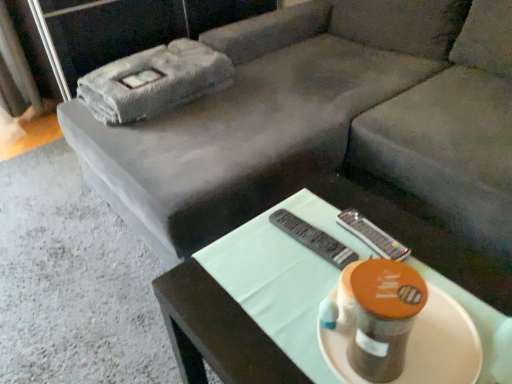
Question: Is the position of matte black table at center more distant than that of matte white platter at center?

Choices:
 (A) no
 (B) yes

Answer: (A)

Question: From the image's perspective, is matte black table at center under matte white platter at center?

Choices:
 (A) yes
 (B) no

Answer: (A)

Question: Does matte black table at center have a larger size compared to matte white platter at center?

Choices:
 (A) no
 (B) yes

Answer: (B)

Question: Does matte black table at center come in front of matte white platter at center?

Choices:
 (A) yes
 (B) no

Answer: (A)

Question: Does matte black table at center have a greater height compared to matte white platter at center?

Choices:
 (A) yes
 (B) no

Answer: (A)

Question: Are matte black table at center and matte white platter at center beside each other?

Choices:
 (A) yes
 (B) no

Answer: (B)

Question: Is matte white platter at center positioned far away from black plastic remote at center?

Choices:
 (A) yes
 (B) no

Answer: (B)

Question: Is matte white platter at center positioned before black plastic remote at center?

Choices:
 (A) yes
 (B) no

Answer: (A)

Question: From a real-world perspective, is matte white platter at center positioned under black plastic remote at center based on gravity?

Choices:
 (A) yes
 (B) no

Answer: (B)

Question: Can you confirm if matte white platter at center is taller than black plastic remote at center?

Choices:
 (A) no
 (B) yes

Answer: (B)

Question: Is black plastic remote at center located within matte white platter at center?

Choices:
 (A) no
 (B) yes

Answer: (A)

Question: From the image's perspective, is matte white platter at center beneath black plastic remote at center?

Choices:
 (A) no
 (B) yes

Answer: (B)

Question: Is black plastic remote at center outside matte white platter at center?

Choices:
 (A) no
 (B) yes

Answer: (B)